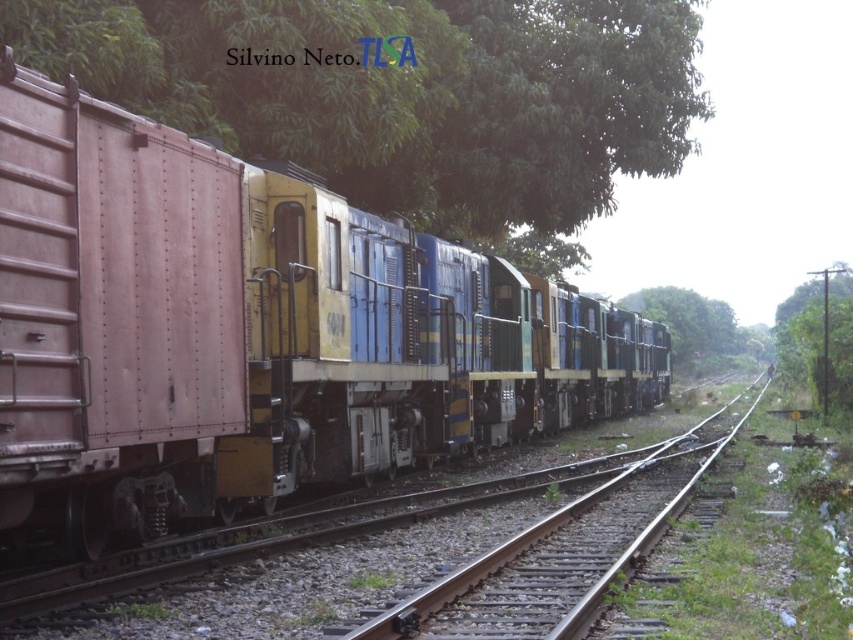
What do you see at coordinates (251, 330) in the screenshot?
I see `rusty metal train car at left` at bounding box center [251, 330].

Find the location of a particular element. Image resolution: width=853 pixels, height=640 pixels. rusty metal train car at left is located at coordinates (251, 330).

Does green leafy tree at upper center have a lesser width compared to green leafy tree at center?

Yes, green leafy tree at upper center is thinner than green leafy tree at center.

Does point (231, 16) come in front of point (686, 305)?

That is True.

Locate an element on the screen. green leafy tree at upper center is located at coordinates (405, 97).

Between brown metal train track at center and green leafy tree at right, which one appears on the left side from the viewer's perspective?

brown metal train track at center

Between brown metal train track at center and green leafy tree at right, which one is positioned lower?

brown metal train track at center is lower down.

Between point (625, 513) and point (799, 285), which one is positioned behind?

The point (799, 285) is more distant.

Where is `brown metal train track at center`? The width and height of the screenshot is (853, 640). brown metal train track at center is located at coordinates (380, 557).